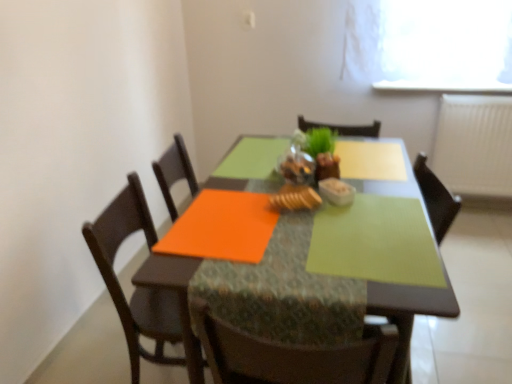
Question: Can you confirm if white textured radiator at right is bigger than green matte placemat at center?

Choices:
 (A) yes
 (B) no

Answer: (B)

Question: From a real-world perspective, does white textured radiator at right sit lower than green matte placemat at center?

Choices:
 (A) yes
 (B) no

Answer: (B)

Question: Is white textured radiator at right taller than green matte placemat at center?

Choices:
 (A) no
 (B) yes

Answer: (A)

Question: Does white textured radiator at right have a lesser width compared to green matte placemat at center?

Choices:
 (A) yes
 (B) no

Answer: (A)

Question: From the image's perspective, is white textured radiator at right on top of green matte placemat at center?

Choices:
 (A) no
 (B) yes

Answer: (B)

Question: Is green matte placemat at center inside white textured radiator at right?

Choices:
 (A) yes
 (B) no

Answer: (B)

Question: From a real-world perspective, is baked golden bread at center positioned under green matte houseplant at center based on gravity?

Choices:
 (A) no
 (B) yes

Answer: (B)

Question: Does baked golden bread at center have a lesser width compared to green matte houseplant at center?

Choices:
 (A) yes
 (B) no

Answer: (B)

Question: Is baked golden bread at center outside of green matte houseplant at center?

Choices:
 (A) yes
 (B) no

Answer: (A)

Question: Is the depth of baked golden bread at center greater than that of green matte houseplant at center?

Choices:
 (A) no
 (B) yes

Answer: (A)

Question: Is the surface of baked golden bread at center in direct contact with green matte houseplant at center?

Choices:
 (A) no
 (B) yes

Answer: (A)

Question: Can you confirm if baked golden bread at center is taller than green matte houseplant at center?

Choices:
 (A) no
 (B) yes

Answer: (A)

Question: Is wooden chair at left smaller than baked golden bread at center?

Choices:
 (A) yes
 (B) no

Answer: (B)